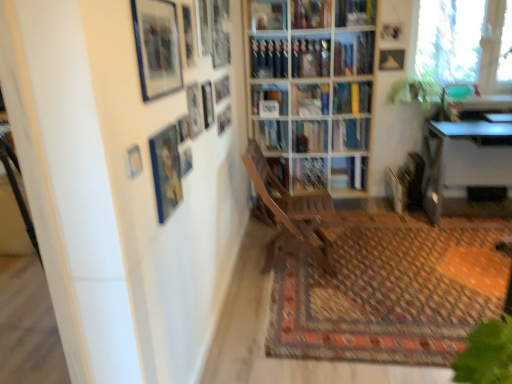
Locate an element on the screen. blank space above blue hardcover book at center, which is the 1th book from bottom to top (from a real-world perspective) is located at coordinates [350, 115].